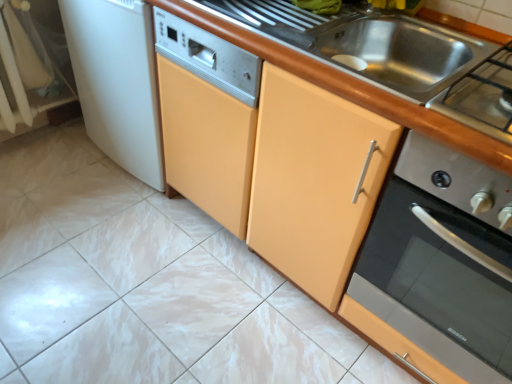
Question: Is stainless steel gas stove at upper right at the back of white plastic dishwasher at center-left, which is the first home appliance from left to right?

Choices:
 (A) yes
 (B) no

Answer: (B)

Question: Can you confirm if white plastic dishwasher at center-left, arranged as the second home appliance when viewed from the right, is wider than stainless steel gas stove at upper right?

Choices:
 (A) no
 (B) yes

Answer: (A)

Question: From the image's perspective, does white plastic dishwasher at center-left, which is the first home appliance from left to right, appear higher than stainless steel gas stove at upper right?

Choices:
 (A) no
 (B) yes

Answer: (B)

Question: Considering the relative positions of white plastic dishwasher at center-left, arranged as the second home appliance when viewed from the right, and stainless steel gas stove at upper right in the image provided, is white plastic dishwasher at center-left, arranged as the second home appliance when viewed from the right, to the left of stainless steel gas stove at upper right from the viewer's perspective?

Choices:
 (A) yes
 (B) no

Answer: (A)

Question: Is white plastic dishwasher at center-left, which is the first home appliance from left to right, next to stainless steel gas stove at upper right and touching it?

Choices:
 (A) yes
 (B) no

Answer: (B)

Question: Can you confirm if white plastic dishwasher at center-left, which is the first home appliance from left to right, is positioned to the left of stainless steel oven at right, the 2th home appliance when ordered from left to right?

Choices:
 (A) no
 (B) yes

Answer: (B)

Question: From a real-world perspective, is white plastic dishwasher at center-left, arranged as the second home appliance when viewed from the right, physically above stainless steel oven at right, the 2th home appliance when ordered from left to right?

Choices:
 (A) yes
 (B) no

Answer: (B)

Question: Does white plastic dishwasher at center-left, arranged as the second home appliance when viewed from the right, lie behind stainless steel oven at right, the 2th home appliance when ordered from left to right?

Choices:
 (A) no
 (B) yes

Answer: (B)

Question: Does white plastic dishwasher at center-left, arranged as the second home appliance when viewed from the right, have a larger size compared to stainless steel oven at right, the 2th home appliance when ordered from left to right?

Choices:
 (A) yes
 (B) no

Answer: (A)

Question: Is white plastic dishwasher at center-left, arranged as the second home appliance when viewed from the right, positioned in front of stainless steel oven at right, the 2th home appliance when ordered from left to right?

Choices:
 (A) no
 (B) yes

Answer: (A)

Question: Is white plastic dishwasher at center-left, which is the first home appliance from left to right, oriented towards stainless steel oven at right, the first home appliance viewed from the right?

Choices:
 (A) no
 (B) yes

Answer: (A)

Question: Is metallic stainless steel sink at upper center not near stainless steel gas stove at upper right?

Choices:
 (A) no
 (B) yes

Answer: (A)